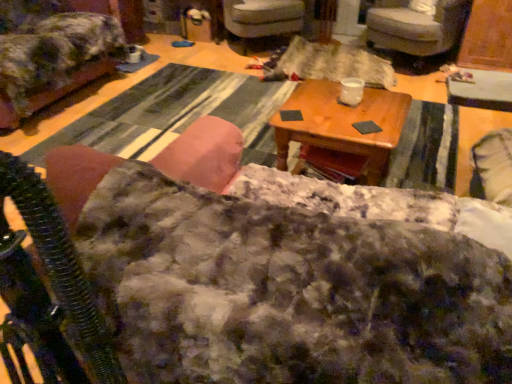
Question: Relative to wooden table at center, is velvet gray armchair at upper right, placed as the third chair when sorted from left to right, in front or behind?

Choices:
 (A) front
 (B) behind

Answer: (B)

Question: Based on their positions, is velvet gray armchair at upper right, which is the 1th chair from right to left, located to the left or right of wooden table at center?

Choices:
 (A) right
 (B) left

Answer: (A)

Question: Based on their relative distances, which object is nearer to the fluffy fabric chair at upper left, which ranks as the third chair in right-to-left order?

Choices:
 (A) velvet gray armchair at upper right, which is the 1th chair from right to left
 (B) fluffy fabric couch at center
 (C) velvet gray armchair at center, which is the 2th chair in right-to-left order
 (D) fuzzy fabric rocking chair at left
 (E) wooden table at center

Answer: (C)

Question: Which is farther from the fluffy fabric couch at center?

Choices:
 (A) fuzzy fabric rocking chair at left
 (B) wooden table at center
 (C) velvet gray armchair at center, which is the 2th chair in right-to-left order
 (D) fluffy fabric chair at upper left, which ranks as the third chair in right-to-left order
 (E) velvet gray armchair at upper right, which is the 1th chair from right to left

Answer: (C)